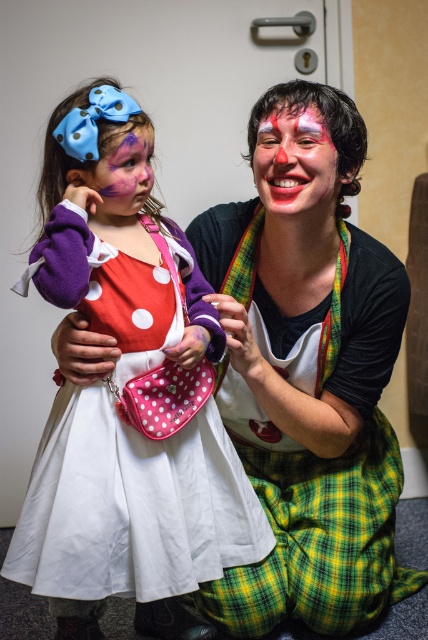
You are standing in front of the image and want to find the point at coordinates [125,410]. Which object in the scene is this point located on?

The point at coordinates [125,410] is located on the white polka dot dress at center.

You are a photographer trying to capture a closeup shot of both the matte clown face at center and the matte purple face at center in the image. Given that your camera lens has a maximum focus range of 10 inches, will you be able to focus on both subjects simultaneously?

The distance between the matte clown face at center and the matte purple face at center is 10.60 inches. Since the camera lens can only focus within 10 inches, the subjects are slightly out of range. You may need to adjust the camera settings or move closer to ensure both faces are in focus.

You are a photographer setting up for a photo shoot. You need to ensure that the white polka dot dress at center and the matte clown face at center are both visible in the frame. Given their sizes, which object should you focus on first to ensure both are in focus?

The white polka dot dress at center is larger in size than the matte clown face at center, so you should focus on the white polka dot dress at center first to ensure both are in focus.